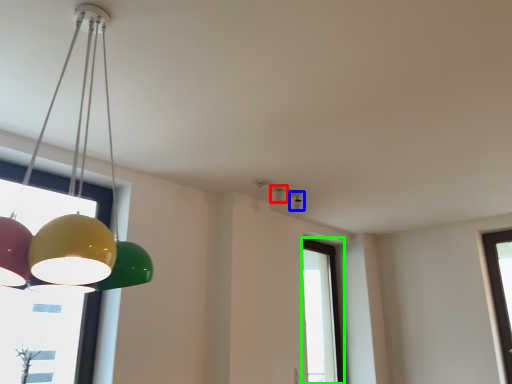
Question: Which object is positioned closest to lamp (highlighted by a red box)? Select from lamp (highlighted by a blue box) and window (highlighted by a green box).

Choices:
 (A) lamp
 (B) window

Answer: (A)